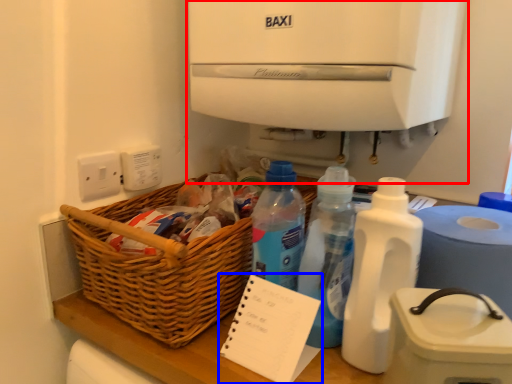
Question: Which object is closer to the camera taking this photo, water cooler (highlighted by a red box) or notepad (highlighted by a blue box)?

Choices:
 (A) water cooler
 (B) notepad

Answer: (B)